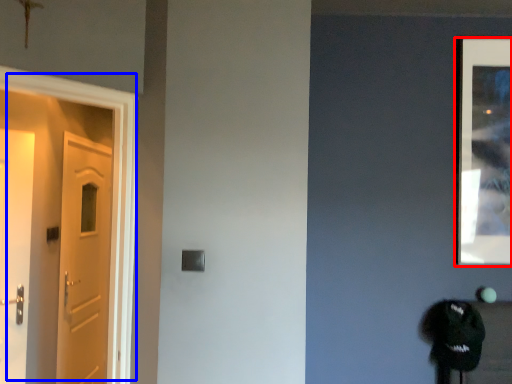
Question: Which of the following is the farthest to the observer, picture frame (highlighted by a red box) or door (highlighted by a blue box)?

Choices:
 (A) picture frame
 (B) door

Answer: (A)